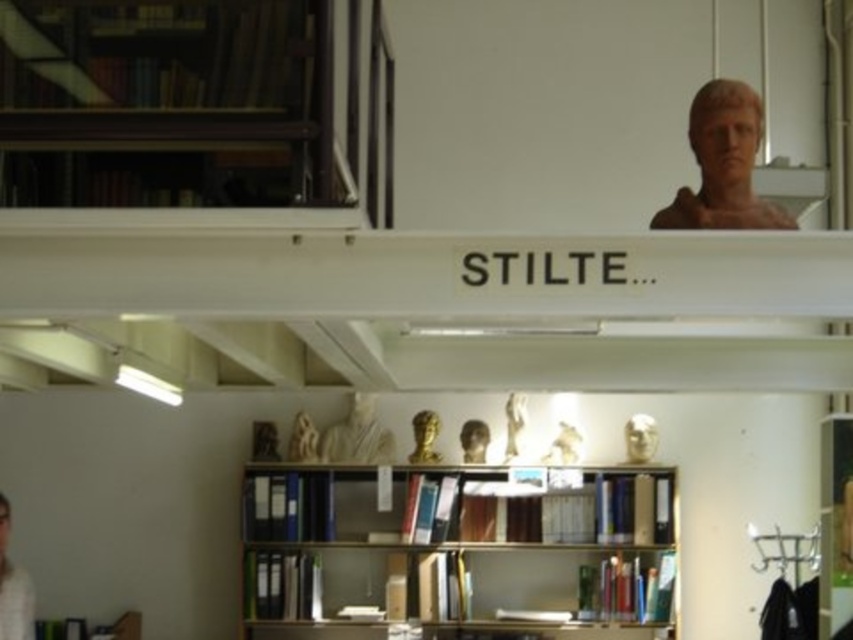
Is dark wood bookcase at upper left thinner than matte white bust at center?

Incorrect, dark wood bookcase at upper left's width is not less than matte white bust at center's.

Locate an element on the screen. The height and width of the screenshot is (640, 853). dark wood bookcase at upper left is located at coordinates (177, 84).

The height and width of the screenshot is (640, 853). I want to click on dark wood bookcase at upper left, so click(177, 84).

Where is `dark wood bookcase at upper left`? The image size is (853, 640). dark wood bookcase at upper left is located at coordinates (177, 84).

Which is above, white matte person at lower left or white marble bust at upper center?

white marble bust at upper center

Which is behind, point (0, 570) or point (648, 456)?

The point (648, 456) is behind.

Where is `white matte person at lower left`? The height and width of the screenshot is (640, 853). white matte person at lower left is located at coordinates (13, 586).

Is point (688, 221) farther from camera compared to point (486, 422)?

No, it is not.

Does point (701, 108) come closer to viewer compared to point (473, 420)?

Yes, it is in front of point (473, 420).

Does point (712, 138) come farther from viewer compared to point (466, 436)?

No.

Identify the location of matte brown bust at upper right. (723, 164).